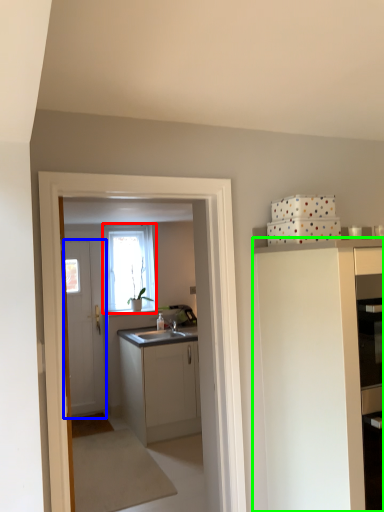
Question: Which is nearer to the window (highlighted by a red box)? door (highlighted by a blue box) or cabinetry (highlighted by a green box).

Choices:
 (A) door
 (B) cabinetry

Answer: (A)